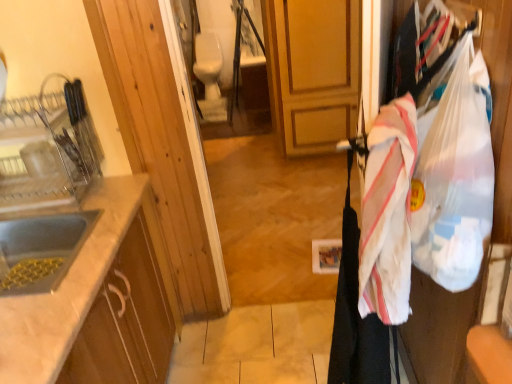
Question: Does point (17, 241) appear closer or farther from the camera than point (384, 240)?

Choices:
 (A) closer
 (B) farther

Answer: (B)

Question: From the image's perspective, is white matte sink at left, the 1th sink positioned from the bottom, above or below white striped fabric at right?

Choices:
 (A) below
 (B) above

Answer: (A)

Question: Estimate the real-world distances between objects in this image. Which object is farther from the white striped fabric at right?

Choices:
 (A) white matte sink at left, the 1th sink positioned from the bottom
 (B) matte silver sink at left, the 2th sink in the bottom-to-top sequence
 (C) white marble countertop at left
 (D) translucent plastic grocery bag at right

Answer: (B)

Question: Which is farther from the white marble countertop at left?

Choices:
 (A) matte silver sink at left, the 2th sink in the bottom-to-top sequence
 (B) white matte sink at left, which is the 2th sink from top to bottom
 (C) white striped fabric at right
 (D) translucent plastic grocery bag at right

Answer: (D)